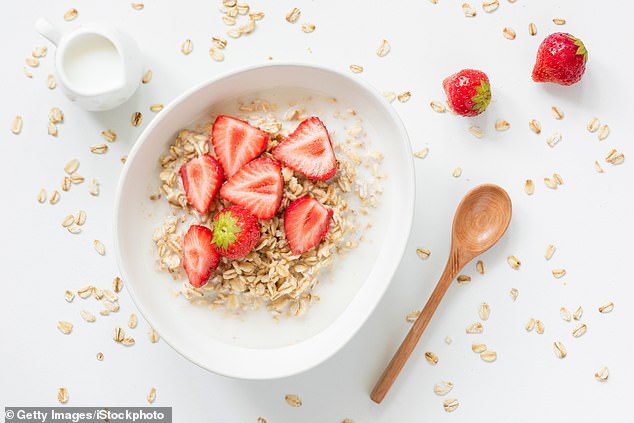
Where is `cereal in bowl`? This screenshot has height=423, width=634. cereal in bowl is located at coordinates (269, 239).